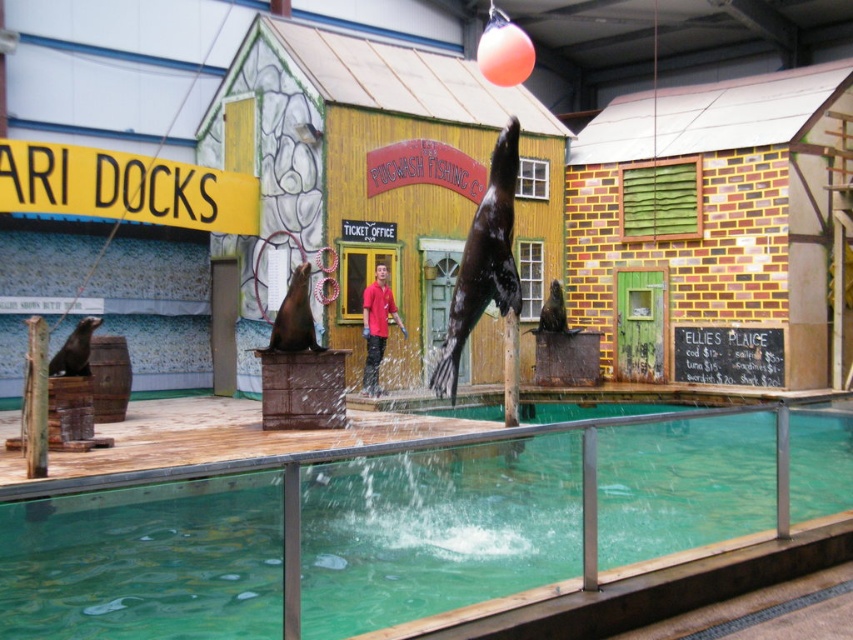
You are standing at the center of the viewing area and notice two points marked in the scene. The first point is at coordinates point (503,60) and the second is at point (367,324). Which point is closer to you?

Point (503,60) is in front of point (367,324), so it is closer to you.